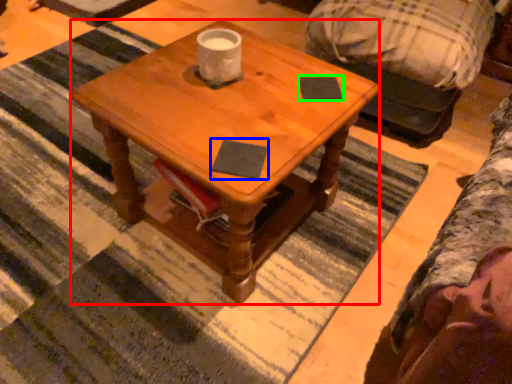
Question: Considering the real-world distances, which object is closest to coffee table (highlighted by a red box)? notepad (highlighted by a blue box) or notepad (highlighted by a green box).

Choices:
 (A) notepad
 (B) notepad

Answer: (A)